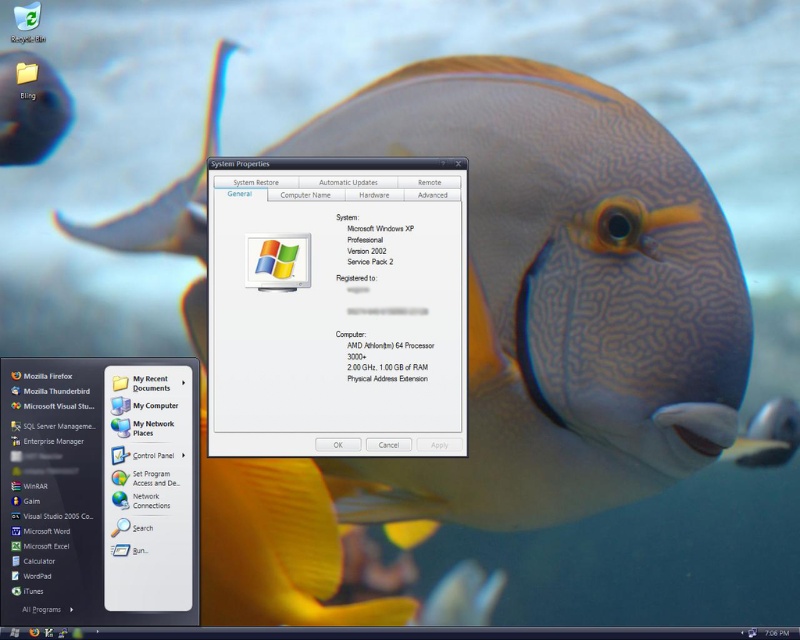
You are trying to determine if the transparent plastic window at center can fully display a document that requires a vertical space taller than the shiny blue fish at upper left. Based on the scene, can it?

The transparent plastic window at center is much taller as shiny blue fish at upper left, so yes, it can fully display the document requiring vertical space taller than the fish.